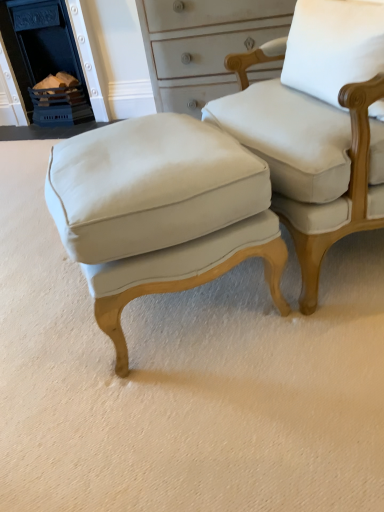
Question: Is point (306, 36) closer or farther from the camera than point (82, 20)?

Choices:
 (A) farther
 (B) closer

Answer: (B)

Question: In terms of height, does white fabric pillow at upper right look taller or shorter compared to blue painted brick fireplace at upper left?

Choices:
 (A) tall
 (B) short

Answer: (B)

Question: Which object is positioned farthest from the matte white stool at center?

Choices:
 (A) white fabric pillow at upper right
 (B) blue painted brick fireplace at upper left
 (C) matte white fabric chair at center

Answer: (B)

Question: Which object is positioned farthest from the blue painted brick fireplace at upper left?

Choices:
 (A) matte white fabric chair at center
 (B) white fabric pillow at upper right
 (C) matte white stool at center

Answer: (B)